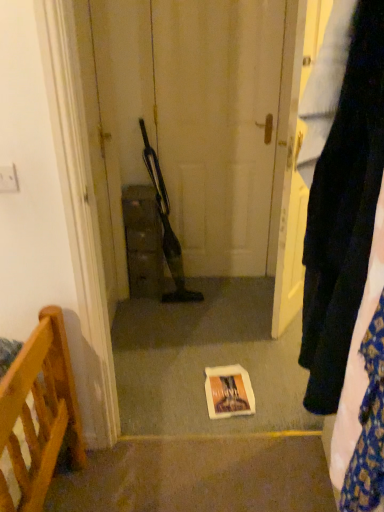
Describe the element at coordinates (228, 392) in the screenshot. I see `white paper bag at center` at that location.

From the picture: What is the approximate height of matte brown cabinet at center?

It is 25.96 inches.

Locate an element on the screen. This screenshot has width=384, height=512. velvet dark blue pants at right is located at coordinates pyautogui.click(x=340, y=190).

The image size is (384, 512). What are the coordinates of `white paper bag at center` in the screenshot? It's located at (228, 392).

How much distance is there between velvet dark blue pants at right and matte brown cabinet at center?

1.54 meters.

Looking at this image, from a real-world perspective, which object rests below the other?

matte brown cabinet at center.

From the image's perspective, between velvet dark blue pants at right and matte brown cabinet at center, who is located below?

velvet dark blue pants at right, from the image's perspective.

Could you tell me if velvet dark blue pants at right is facing matte brown cabinet at center?

No, velvet dark blue pants at right is not facing towards matte brown cabinet at center.

Is matte brown cabinet at center oriented towards white paper bag at center?

No, matte brown cabinet at center is not facing towards white paper bag at center.

Considering the relative sizes of matte brown cabinet at center and white paper bag at center in the image provided, is matte brown cabinet at center taller than white paper bag at center?

Yes.

From the image's perspective, who appears lower, matte brown cabinet at center or white paper bag at center?

white paper bag at center, from the image's perspective.

Measure the distance from matte brown cabinet at center to white paper bag at center.

The distance of matte brown cabinet at center from white paper bag at center is 34.05 inches.

Is matte brown cabinet at center at the back of white paper bag at center?

white paper bag at center is not turned away from matte brown cabinet at center.

From the image's perspective, which object appears higher, white paper bag at center or matte brown cabinet at center?

From the image's view, matte brown cabinet at center is above.

What are the coordinates of `cabinetry located above the white paper bag at center (from the image's perspective)` in the screenshot? It's located at (143, 241).

Where is `copy below the velvet dark blue pants at right (from a real-world perspective)`? copy below the velvet dark blue pants at right (from a real-world perspective) is located at coordinates click(228, 392).

Considering the sizes of objects velvet dark blue pants at right and white paper bag at center in the image provided, who is shorter, velvet dark blue pants at right or white paper bag at center?

Standing shorter between the two is white paper bag at center.

Can you see velvet dark blue pants at right touching white paper bag at center?

No, velvet dark blue pants at right is not in contact with white paper bag at center.

Based on the photo, from the image's perspective, is velvet dark blue pants at right positioned above or below white paper bag at center?

Clearly, from the image's perspective, velvet dark blue pants at right is above white paper bag at center.

Between matte brown cabinet at center and velvet dark blue pants at right, which one has larger size?

With larger size is matte brown cabinet at center.

From the image's perspective, who appears lower, matte brown cabinet at center or velvet dark blue pants at right?

velvet dark blue pants at right appears lower in the image.

How different are the orientations of matte brown cabinet at center and velvet dark blue pants at right in degrees?

There is a 96.5-degree angle between the facing directions of matte brown cabinet at center and velvet dark blue pants at right.

Could you tell me if matte brown cabinet at center is facing velvet dark blue pants at right?

No, matte brown cabinet at center is not turned towards velvet dark blue pants at right.

Is point (226, 414) positioned behind point (346, 297)?

Yes, it is.

Is white paper bag at center inside the boundaries of velvet dark blue pants at right, or outside?

white paper bag at center cannot be found inside velvet dark blue pants at right.

Is white paper bag at center wider or thinner than velvet dark blue pants at right?

In the image, white paper bag at center appears to be wider than velvet dark blue pants at right.

Which of these two, white paper bag at center or velvet dark blue pants at right, is bigger?

With larger size is velvet dark blue pants at right.

The image size is (384, 512). What are the coordinates of `cabinetry that appears below the velvet dark blue pants at right (from a real-world perspective)` in the screenshot? It's located at pos(143,241).

Image resolution: width=384 pixels, height=512 pixels. I want to click on cabinetry located behind the white paper bag at center, so click(x=143, y=241).

From the image, which object appears to be farther from velvet dark blue pants at right, matte brown cabinet at center or white paper bag at center?

matte brown cabinet at center lies further to velvet dark blue pants at right than the other object.

Which object lies nearer to the anchor point white paper bag at center, matte brown cabinet at center or velvet dark blue pants at right?

Among the two, matte brown cabinet at center is located nearer to white paper bag at center.

Considering their positions, is white paper bag at center positioned further to velvet dark blue pants at right than matte brown cabinet at center?

matte brown cabinet at center is further to velvet dark blue pants at right.

Based on their spatial positions, is velvet dark blue pants at right or white paper bag at center closer to matte brown cabinet at center?

Based on the image, white paper bag at center appears to be nearer to matte brown cabinet at center.

Based on their spatial positions, is white paper bag at center or velvet dark blue pants at right closer to matte brown cabinet at center?

white paper bag at center is closer to matte brown cabinet at center.

From the image, which object appears to be farther from white paper bag at center, velvet dark blue pants at right or matte brown cabinet at center?

The object further to white paper bag at center is velvet dark blue pants at right.

Locate an element on the screen. Image resolution: width=384 pixels, height=512 pixels. copy located between velvet dark blue pants at right and matte brown cabinet at center in the depth direction is located at coordinates click(228, 392).